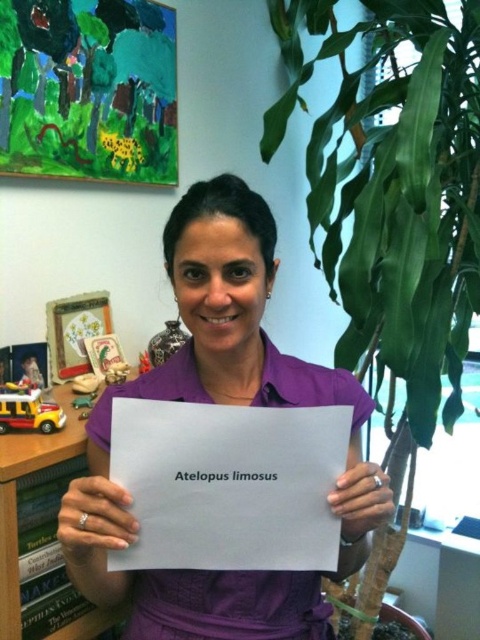
You are standing in the room and want to place a small sticker on the wall. You have two points marked in the image where you can choose to place it. The first point is at coordinates point (x=376, y=561) and the second point is at point (x=8, y=502). Which point is closer to the window that is partially hidden by the large green plant on the right side of the woman?

Point (x=8, y=502) is closer to the window that is partially hidden by the large green plant on the right side of the woman because it is positioned lower and to the right compared to point (x=376, y=561), which is behind it.

You are an observer looking at the image. There is a point marked at coordinate (228,484). What object is located at this point?

The point at coordinate (228,484) indicates the white paper at center.